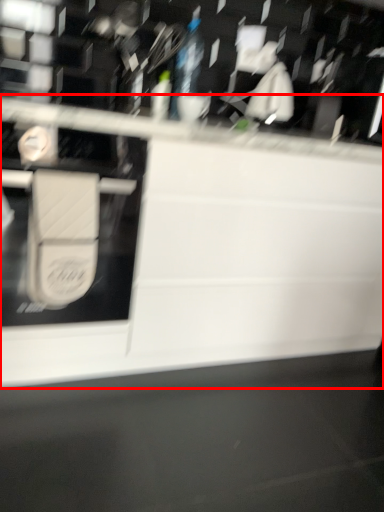
Question: From the image's perspective, considering the relative positions of countertop (annotated by the red box) and wide in the image provided, where is countertop (annotated by the red box) located with respect to the staircase?

Choices:
 (A) above
 (B) below

Answer: (A)